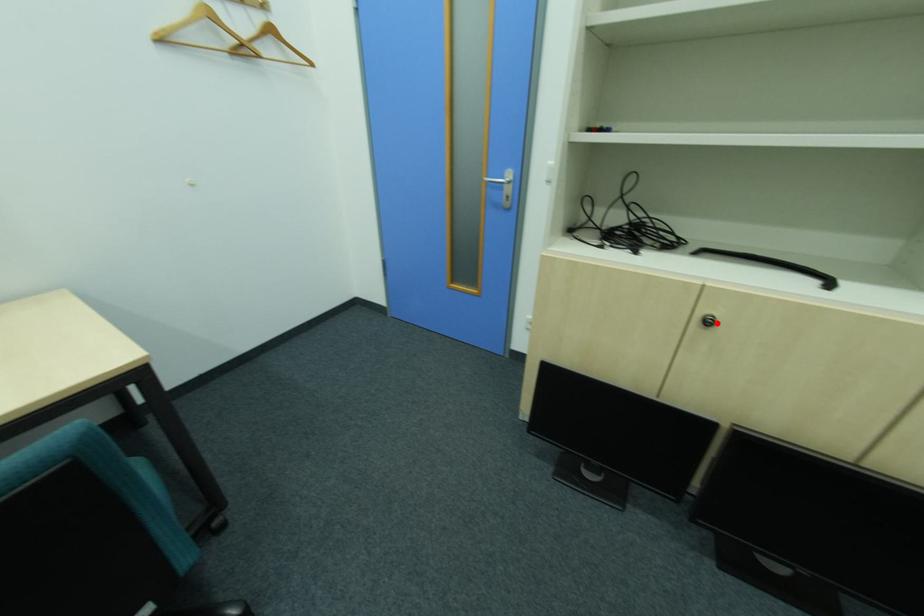
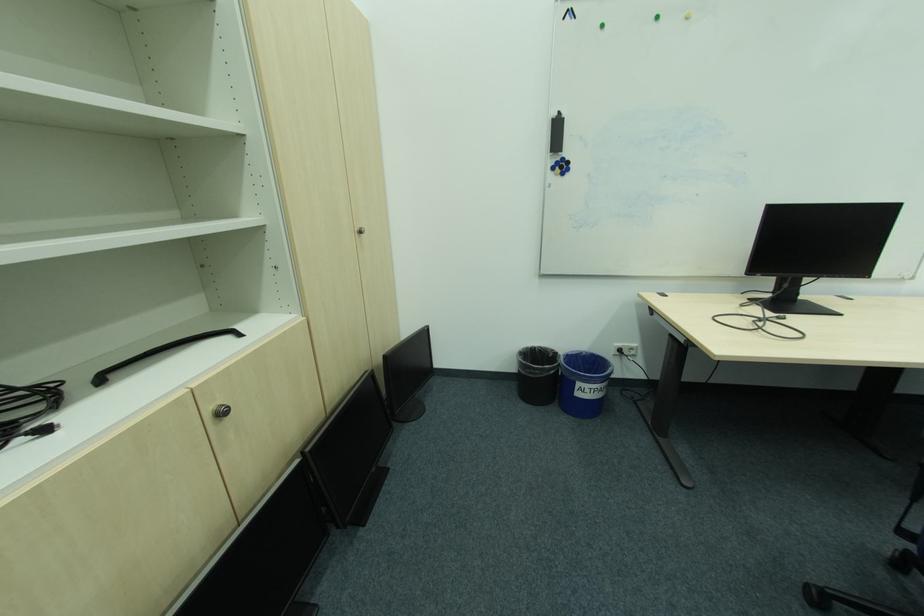
Find the pixel in the second image that matches the highlighted location in the first image.

(227, 415)